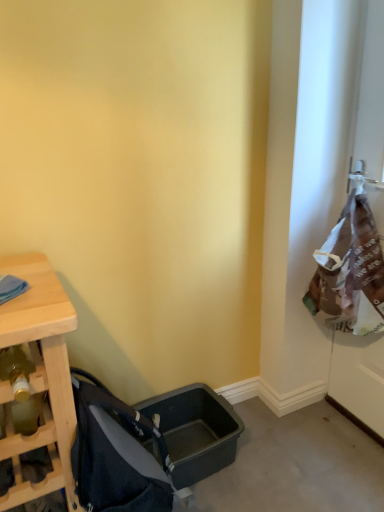
Question: Relative to dark gray fabric baby carriage at lower left, is brown paper bag at right in front or behind?

Choices:
 (A) behind
 (B) front

Answer: (A)

Question: Based on their sizes in the image, would you say brown paper bag at right is bigger or smaller than dark gray fabric baby carriage at lower left?

Choices:
 (A) big
 (B) small

Answer: (A)

Question: In terms of width, does brown paper bag at right look wider or thinner when compared to dark gray fabric baby carriage at lower left?

Choices:
 (A) thin
 (B) wide

Answer: (A)

Question: In the image, is dark gray fabric baby carriage at lower left positioned in front of or behind brown paper bag at right?

Choices:
 (A) behind
 (B) front

Answer: (B)

Question: Based on their positions, is dark gray fabric baby carriage at lower left located to the left or right of brown paper bag at right?

Choices:
 (A) right
 (B) left

Answer: (B)

Question: Considering the positions of dark gray fabric baby carriage at lower left and brown paper bag at right in the image, is dark gray fabric baby carriage at lower left bigger or smaller than brown paper bag at right?

Choices:
 (A) big
 (B) small

Answer: (B)

Question: From a real-world perspective, is dark gray fabric baby carriage at lower left positioned above or below brown paper bag at right?

Choices:
 (A) above
 (B) below

Answer: (B)